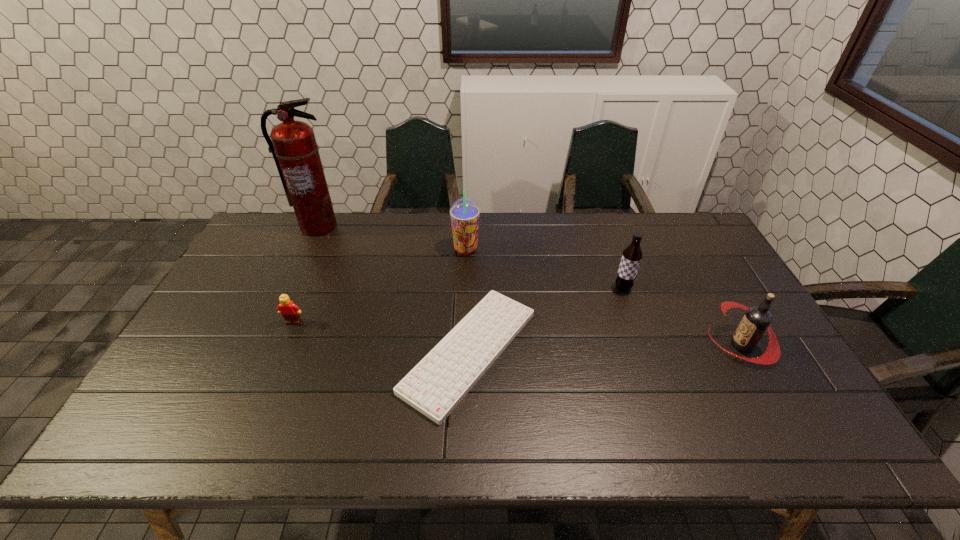
Identify the location of vacant area in the image that satisfies the following two spatial constraints: 1. on the side of the fourth nearest object with the handle and hose; 2. on the right side of the farthest object. The image size is (960, 540). (289, 288).

Image resolution: width=960 pixels, height=540 pixels. I want to click on free space that satisfies the following two spatial constraints: 1. on the face of the shortest object; 2. on the right side of the second shortest object, so click(x=281, y=351).